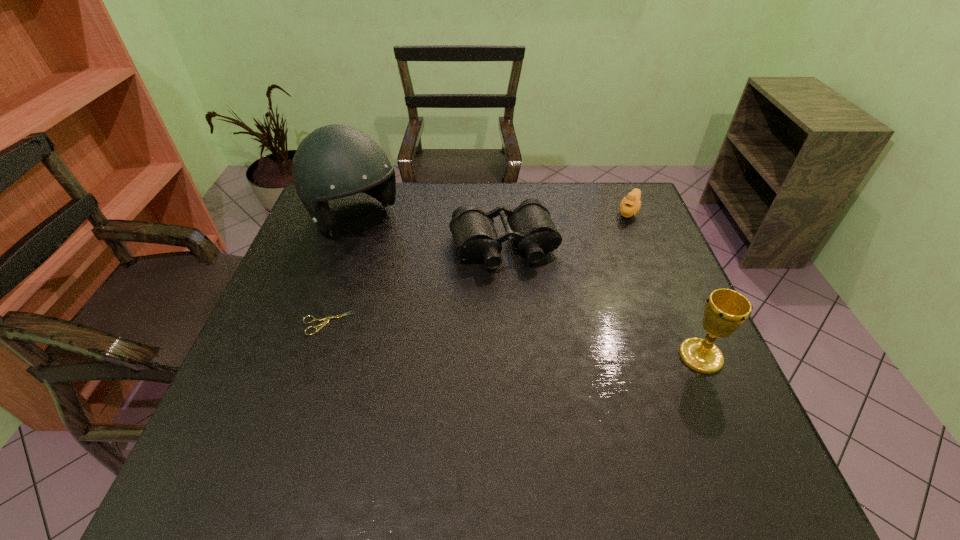
Locate an element on the screen. Image resolution: width=960 pixels, height=540 pixels. the shortest object is located at coordinates (326, 320).

At what (x,y) coordinates should I click in order to perform the action: click on the fourth farthest object. Please return your answer as a coordinate pair (x, y). Image resolution: width=960 pixels, height=540 pixels. Looking at the image, I should click on (326, 320).

You are a GUI agent. You are given a task and a screenshot of the screen. Output one action in this format:
    pyautogui.click(x=<x>, y=<y>)
    Task: Click on the nearest object
    The width and height of the screenshot is (960, 540).
    Given the screenshot: What is the action you would take?
    pyautogui.click(x=726, y=310)

Locate an element on the screen. Image resolution: width=960 pixels, height=540 pixels. chalice is located at coordinates (726, 310).

Where is `binoculars`? binoculars is located at coordinates (530, 225).

At what (x,y) coordinates should I click in order to perform the action: click on football helmet. Please return your answer as a coordinate pair (x, y). Looking at the image, I should click on (334, 161).

Image resolution: width=960 pixels, height=540 pixels. In order to click on duckling in this screenshot , I will do `click(630, 205)`.

Identify the location of vacant region located 0.050m on the front of the shears. The height and width of the screenshot is (540, 960). point(317,353).

The image size is (960, 540). Identify the location of free space located on the back of the nearest object. (667, 280).

I want to click on free spot located 0.380m through the eyepieces of the binoculars, so click(562, 399).